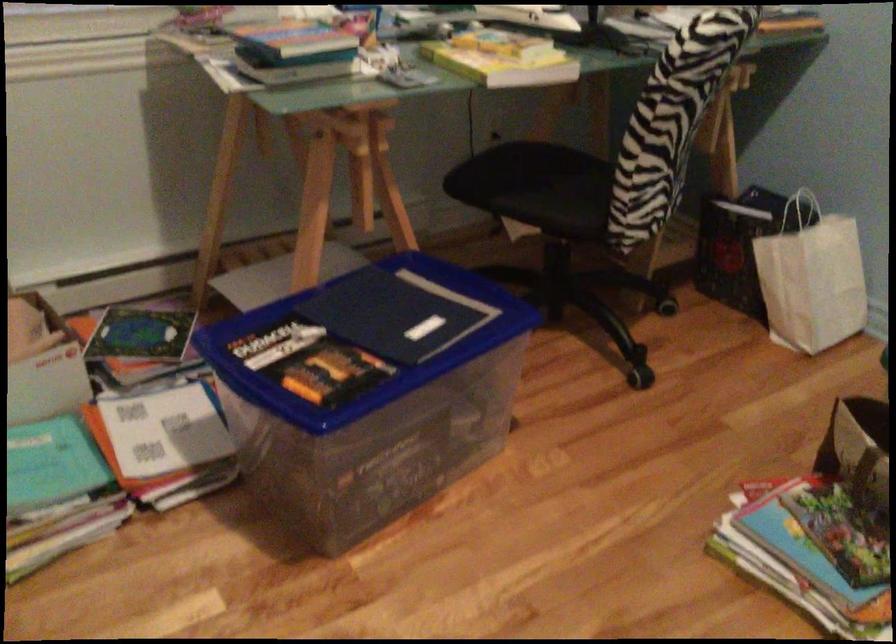
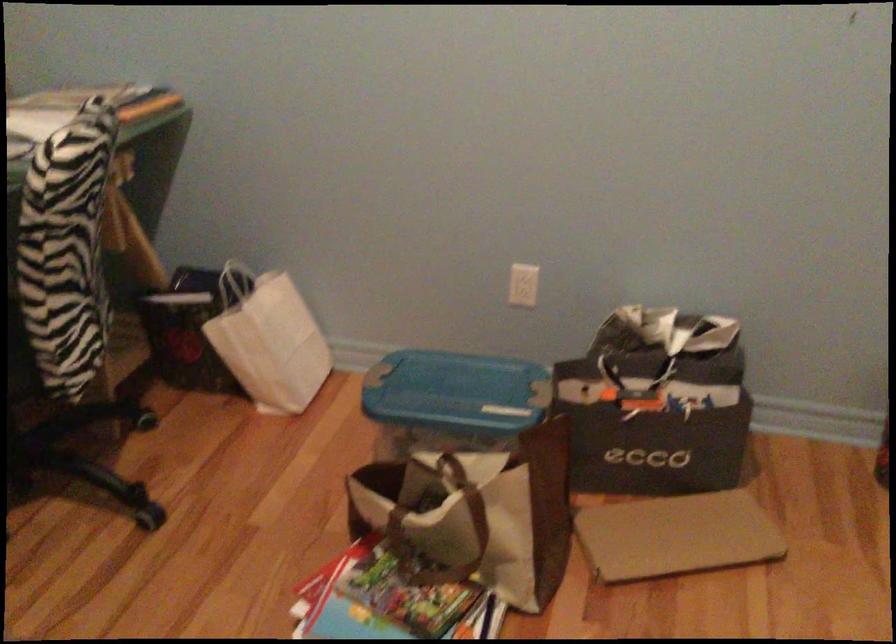
Question: Based on the continuous images, in which direction is the camera rotating? Reply with the corresponding letter.

Choices:
 (A) Left
 (B) Right
 (C) Up
 (D) Down

Answer: (B)